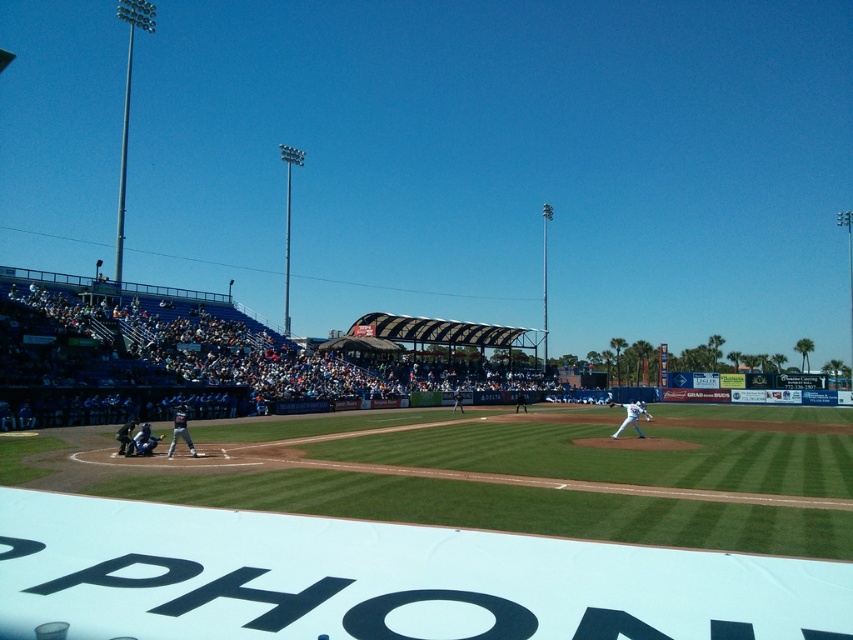
You are a photographer standing at the center of the baseball field and want to take a photo that includes both the point at coordinates point [65,342] and point [624,406]. Given that you can only focus on one point clearly, which point should you focus on to ensure it appears sharp in the foreground?

You should focus on point [65,342] because it is closer to the camera than point [624,406], so focusing on it will keep it sharp in the foreground while the other point may appear slightly blurred.

You are a spectator at the baseball stadium and want to take a photo of the blue jersey baseball team at left and the white matte baseball bat at center. Which object should you focus on first to ensure both are in the frame?

The blue jersey baseball team at left is positioned over the white matte baseball bat at center, so you should focus on the blue jersey baseball team at left first to ensure both are in the frame.

In the scene shown: You are a photographer standing at the point marked by the coordinates point (631,417) in the image. What object is directly in front of you?

The point (631,417) marks the white matte baseball bat at center, so the object directly in front of you is the white matte baseball bat at center.